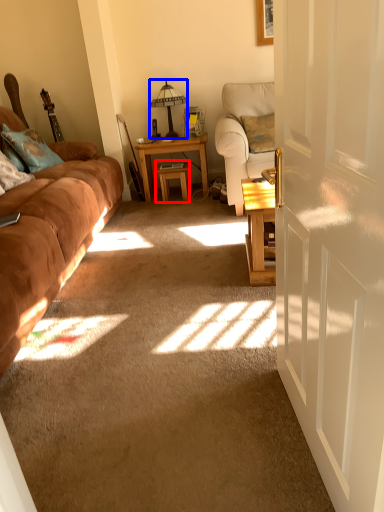
Question: Among these objects, which one is farthest to the camera, table (highlighted by a red box) or table lamp (highlighted by a blue box)?

Choices:
 (A) table
 (B) table lamp

Answer: (A)